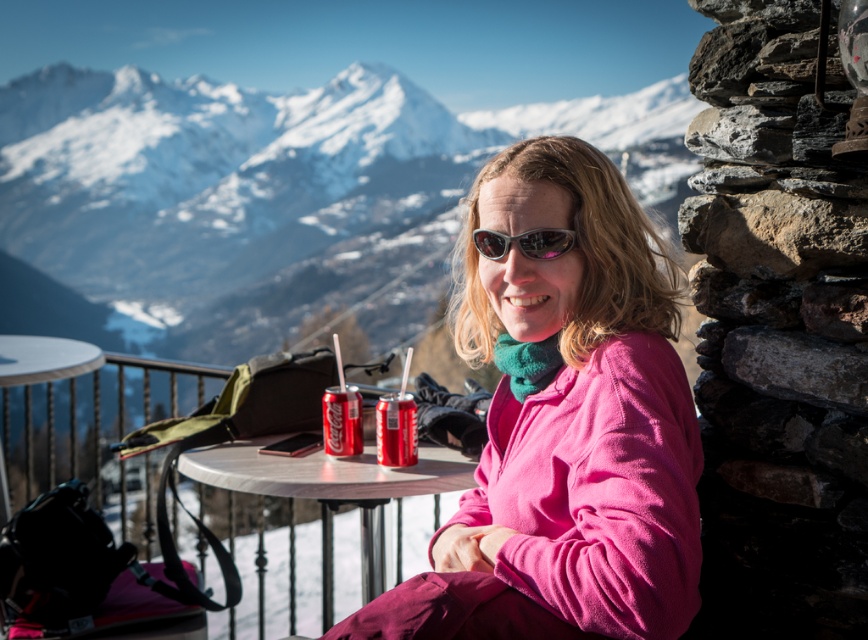
You are standing at the viewpoint where the person in the pink jacket is sitting. You want to move towards the point labeled as point (352, 451). Will you pass by point (663, 314) on your way there?

Yes, because point (663, 314) is in front of point (352, 451), so you will pass by point (663, 314) on your way to point (352, 451).

You are a photographer wanting to capture the reflection of the metallic silver table at center in the sunglasses at center. Is this possible given their positions?

The metallic silver table at center is positioned under sunglasses at center, so the reflection of the table can be seen in the sunglasses since the table is below them.